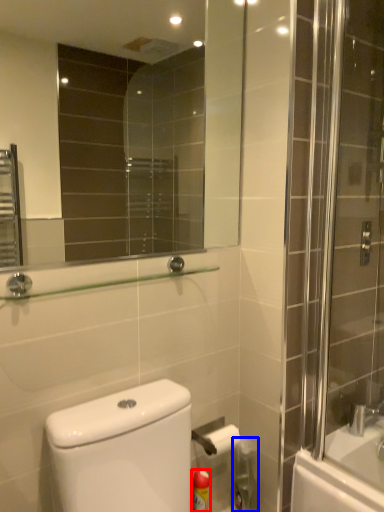
Question: Among these objects, which one is farthest to the camera, cleaning product (highlighted by a red box) or cleaning product (highlighted by a blue box)?

Choices:
 (A) cleaning product
 (B) cleaning product

Answer: (B)